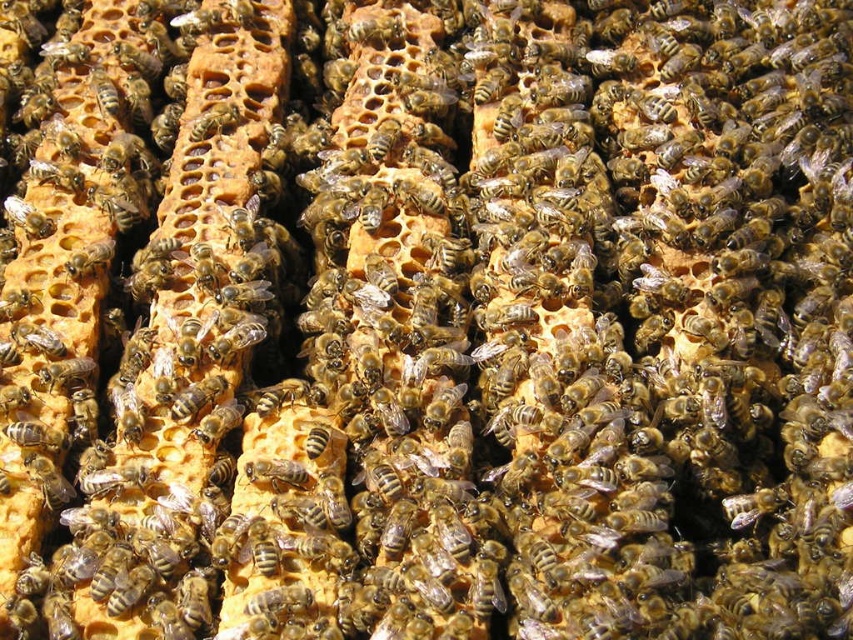
Question: Among these objects, which one is nearest to the camera?

Choices:
 (A) brown fuzzy bee at center
 (B) translucent golden honeycomb at upper left

Answer: (A)

Question: Which point is closer to the camera taking this photo?

Choices:
 (A) (12, 221)
 (B) (294, 481)

Answer: (B)

Question: Is brown fuzzy bee at center to the right of translucent golden honeycomb at upper left from the viewer's perspective?

Choices:
 (A) no
 (B) yes

Answer: (B)

Question: Is brown fuzzy bee at center thinner than translucent golden honeycomb at upper left?

Choices:
 (A) no
 (B) yes

Answer: (B)

Question: Which object appears closest to the camera in this image?

Choices:
 (A) brown fuzzy bee at center
 (B) translucent golden honeycomb at upper left

Answer: (A)

Question: Is brown fuzzy bee at center closer to camera compared to translucent golden honeycomb at upper left?

Choices:
 (A) no
 (B) yes

Answer: (B)